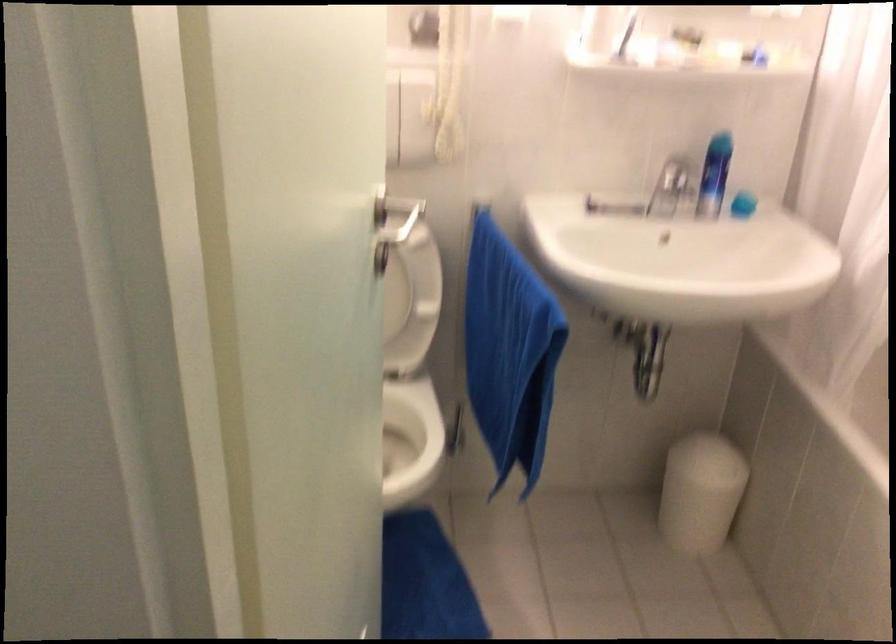
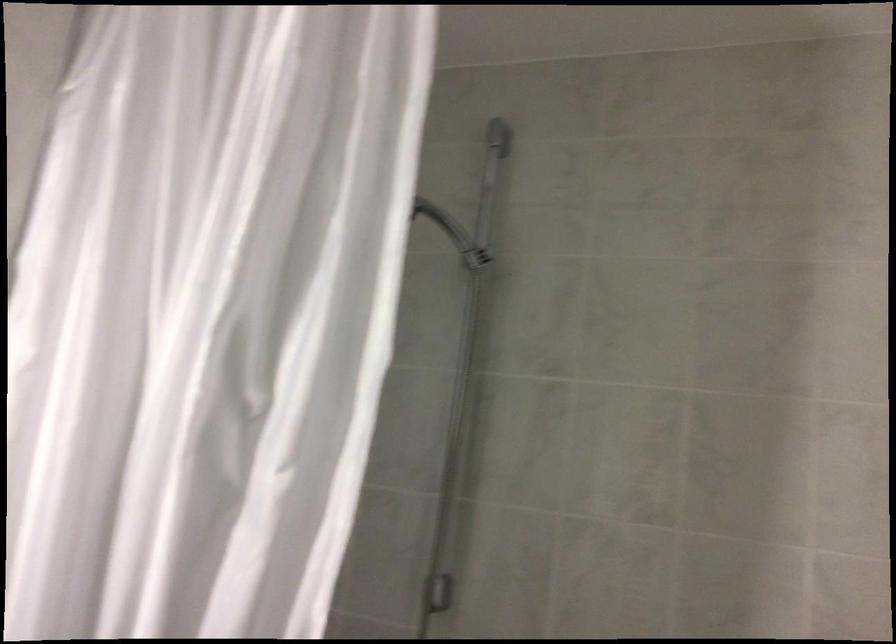
Based on the continuous images, in which direction is the camera rotating?

The camera rotated toward right-up.